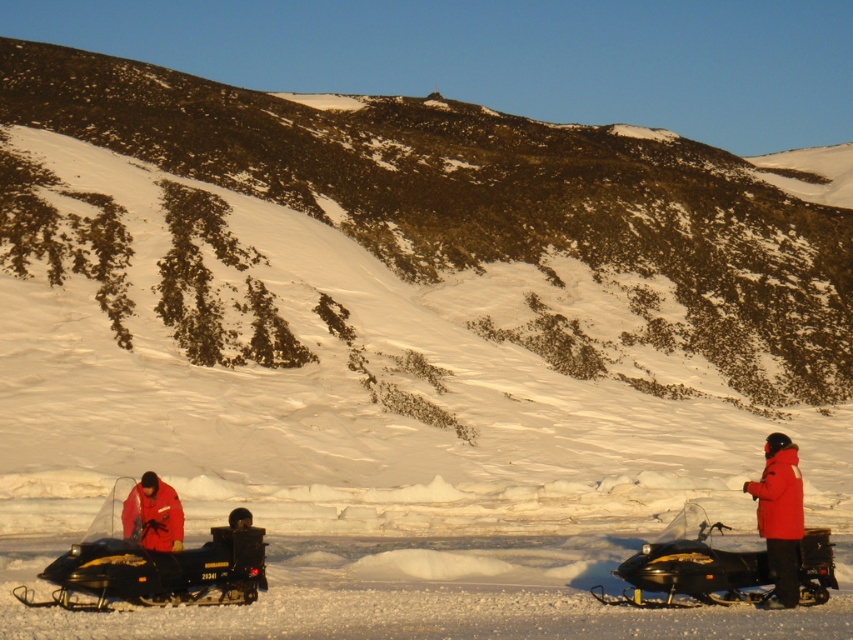
Is point (149, 504) behind point (633, 564)?

That is True.

Is black matte snowmobile at lower left thinner than black plastic snowmobile at right?

Yes, black matte snowmobile at lower left is thinner than black plastic snowmobile at right.

What do you see at coordinates (154, 556) in the screenshot?
I see `black matte snowmobile at lower left` at bounding box center [154, 556].

Where is `black matte snowmobile at lower left`? The image size is (853, 640). black matte snowmobile at lower left is located at coordinates (154, 556).

Is black plastic snowmobile at right to the left of red synthetic jacket at right from the viewer's perspective?

Correct, you'll find black plastic snowmobile at right to the left of red synthetic jacket at right.

Which of these two, black plastic snowmobile at right or red synthetic jacket at right, stands taller?

red synthetic jacket at right

The width and height of the screenshot is (853, 640). What do you see at coordinates (689, 566) in the screenshot?
I see `black plastic snowmobile at right` at bounding box center [689, 566].

I want to click on black plastic snowmobile at right, so click(x=689, y=566).

Describe the element at coordinates (780, 516) in the screenshot. I see `red synthetic jacket at right` at that location.

Does red synthetic jacket at right appear over red matte jacket at lower left?

Incorrect, red synthetic jacket at right is not positioned above red matte jacket at lower left.

Is point (782, 541) behind point (154, 512)?

No, it is not.

You are a GUI agent. You are given a task and a screenshot of the screen. Output one action in this format:
    pyautogui.click(x=<x>, y=<y>)
    Task: Click on the red synthetic jacket at right
    The width and height of the screenshot is (853, 640).
    Given the screenshot: What is the action you would take?
    pyautogui.click(x=780, y=516)